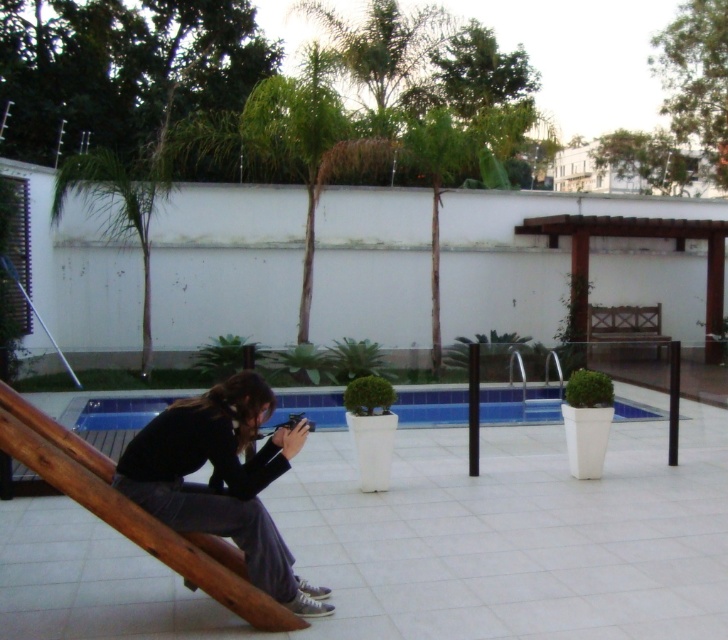
Question: In this image, where is matte black camera at lower left located relative to blue tile swimming pool at center?

Choices:
 (A) above
 (B) below

Answer: (A)

Question: Which point appears farthest from the camera in this image?

Choices:
 (A) (443, 410)
 (B) (201, 394)

Answer: (B)

Question: Is matte black camera at lower left closer to the viewer compared to blue tile swimming pool at center?

Choices:
 (A) no
 (B) yes

Answer: (B)

Question: Can you confirm if matte black camera at lower left is thinner than blue tile swimming pool at center?

Choices:
 (A) no
 (B) yes

Answer: (A)